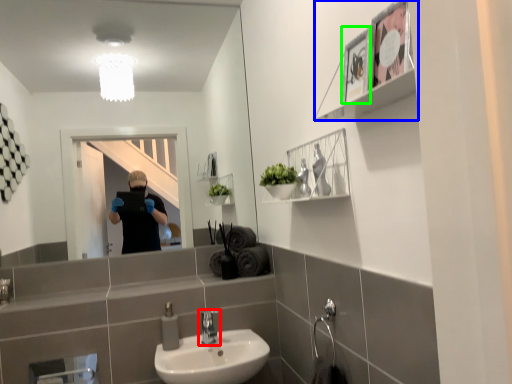
Question: Based on their relative distances, which object is nearer to tap (highlighted by a red box)? Choose from cabinet (highlighted by a blue box) and picture frame (highlighted by a green box).

Choices:
 (A) cabinet
 (B) picture frame

Answer: (B)